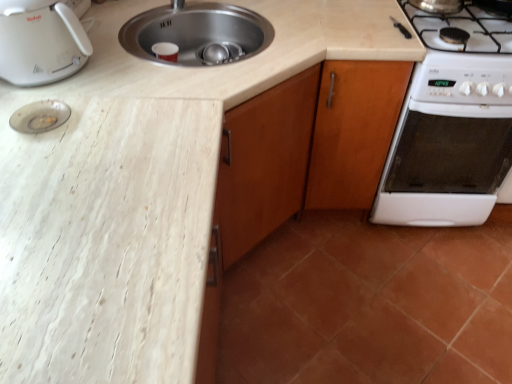
Where is `free spot above white marble countertop at left (from a real-world perspective)`? The image size is (512, 384). free spot above white marble countertop at left (from a real-world perspective) is located at coordinates (89, 182).